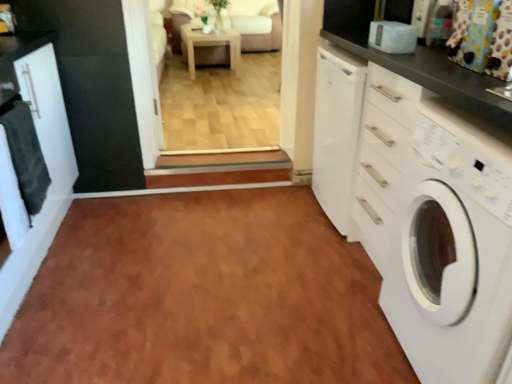
Question: Is multicolored fabric curtain at upper right not inside white glossy cabinet at left?

Choices:
 (A) yes
 (B) no

Answer: (A)

Question: Does multicolored fabric curtain at upper right touch white glossy cabinet at left?

Choices:
 (A) no
 (B) yes

Answer: (A)

Question: Does multicolored fabric curtain at upper right have a greater height compared to white glossy cabinet at left?

Choices:
 (A) no
 (B) yes

Answer: (A)

Question: Is white glossy cabinet at left a part of multicolored fabric curtain at upper right?

Choices:
 (A) yes
 (B) no

Answer: (B)

Question: Is multicolored fabric curtain at upper right closer to camera compared to white glossy cabinet at left?

Choices:
 (A) no
 (B) yes

Answer: (A)

Question: From a real-world perspective, is light brown wooden table at center above or below brown laminate floor at center?

Choices:
 (A) below
 (B) above

Answer: (B)

Question: Is light brown wooden table at center inside or outside of brown laminate floor at center?

Choices:
 (A) outside
 (B) inside

Answer: (A)

Question: Is point (208, 34) positioned closer to the camera than point (133, 306)?

Choices:
 (A) closer
 (B) farther

Answer: (B)

Question: In terms of height, does light brown wooden table at center look taller or shorter compared to brown laminate floor at center?

Choices:
 (A) short
 (B) tall

Answer: (B)

Question: Would you say multicolored fabric curtain at upper right is to the left or to the right of brown laminate floor at center in the picture?

Choices:
 (A) right
 (B) left

Answer: (A)

Question: Choose the correct answer: Is multicolored fabric curtain at upper right inside brown laminate floor at center or outside it?

Choices:
 (A) inside
 (B) outside

Answer: (B)

Question: Is point (487, 59) positioned closer to the camera than point (78, 372)?

Choices:
 (A) closer
 (B) farther

Answer: (A)

Question: Considering their positions, is multicolored fabric curtain at upper right located in front of or behind brown laminate floor at center?

Choices:
 (A) behind
 (B) front

Answer: (B)

Question: Is dark gray towel at left in front of or behind white glossy cabinet at left in the image?

Choices:
 (A) behind
 (B) front

Answer: (A)

Question: From the image's perspective, is dark gray towel at left located above or below white glossy cabinet at left?

Choices:
 (A) below
 (B) above

Answer: (B)